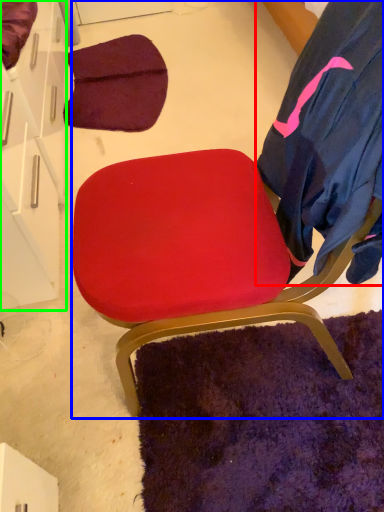
Question: Based on their relative distances, which object is nearer to robe (highlighted by a red box)? Choose from chair (highlighted by a blue box) and drawer (highlighted by a green box).

Choices:
 (A) chair
 (B) drawer

Answer: (A)